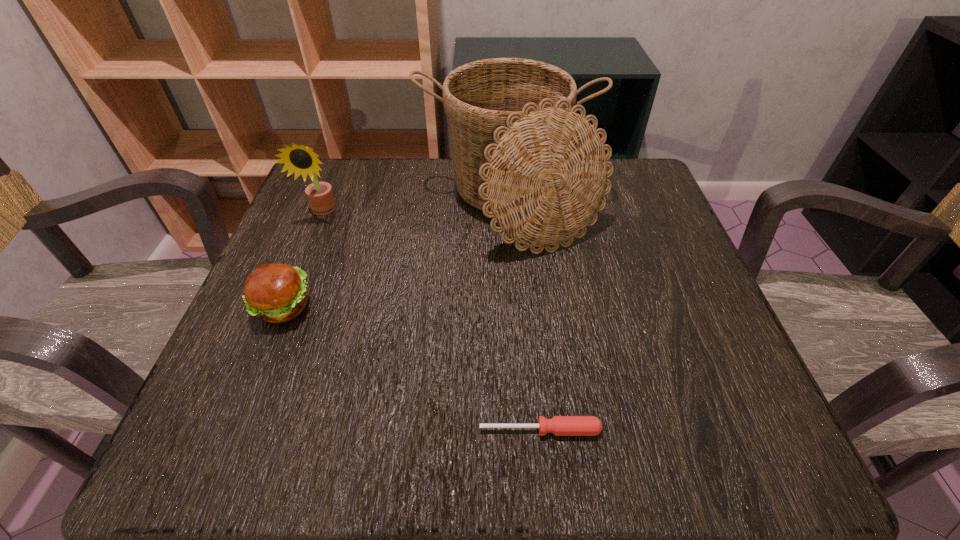
Where is `blank area at the left edge`? blank area at the left edge is located at coordinates (298, 343).

In order to click on free space at the right edge of the desktop in this screenshot , I will do `click(693, 335)`.

The height and width of the screenshot is (540, 960). I want to click on free point at the far left corner, so click(367, 214).

The image size is (960, 540). In the image, there is a desktop. In order to click on vacant space at the far right corner in this screenshot , I will do `click(658, 217)`.

In the image, there is a desktop. Identify the location of vacant space at the near right corner. (718, 463).

Identify the location of vacant space in between the nearest object and the third shortest object. (431, 320).

What are the coordinates of `vacant area that lies between the third tallest object and the screwdriver` in the screenshot? It's located at (412, 368).

This screenshot has height=540, width=960. What are the coordinates of `empty space between the screwdriver and the second shortest object` in the screenshot? It's located at (412, 368).

You are a GUI agent. You are given a task and a screenshot of the screen. Output one action in this format:
    pyautogui.click(x=<x>, y=<y>)
    Task: Click on the vacant space in between the second nearest object and the second tallest object
    Image resolution: width=960 pixels, height=540 pixels.
    Given the screenshot: What is the action you would take?
    pyautogui.click(x=302, y=259)

The width and height of the screenshot is (960, 540). In order to click on vacant point located between the hamburger and the shortest object in this screenshot , I will do `click(412, 368)`.